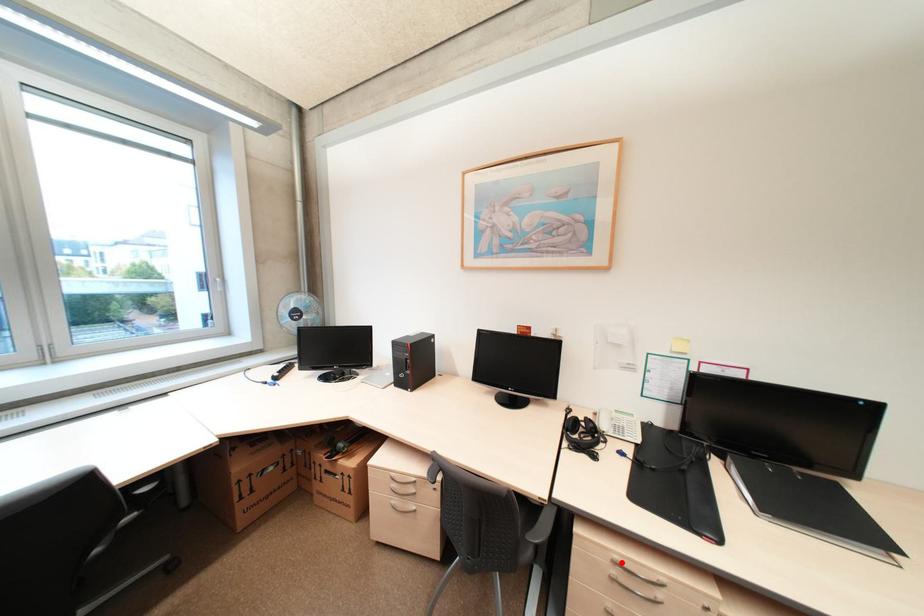
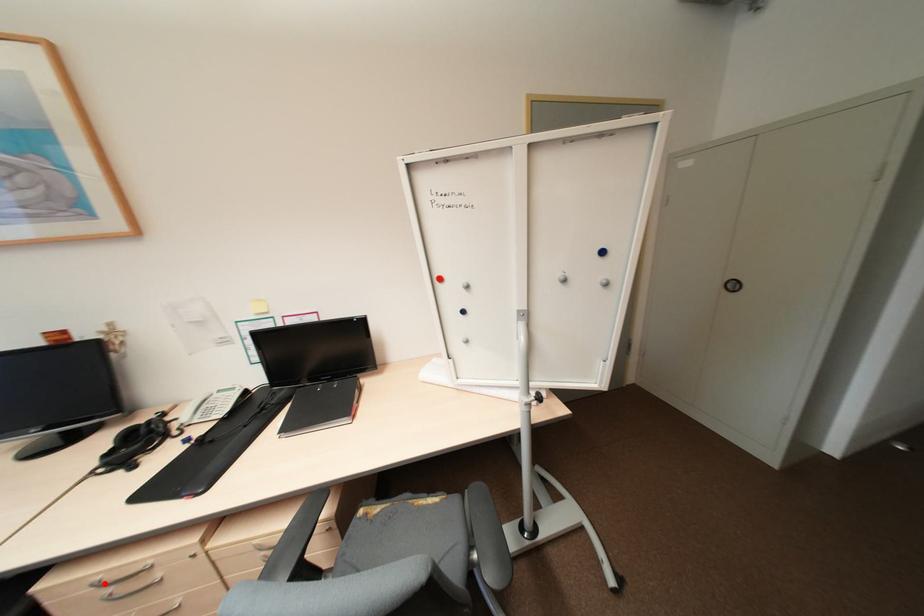
I am providing you with two images of the same scene from different viewpoints. A red point is marked on the first image and another point is marked on the second image. Do the highlighted points in image1 and image2 indicate the same real-world spot?

Yes